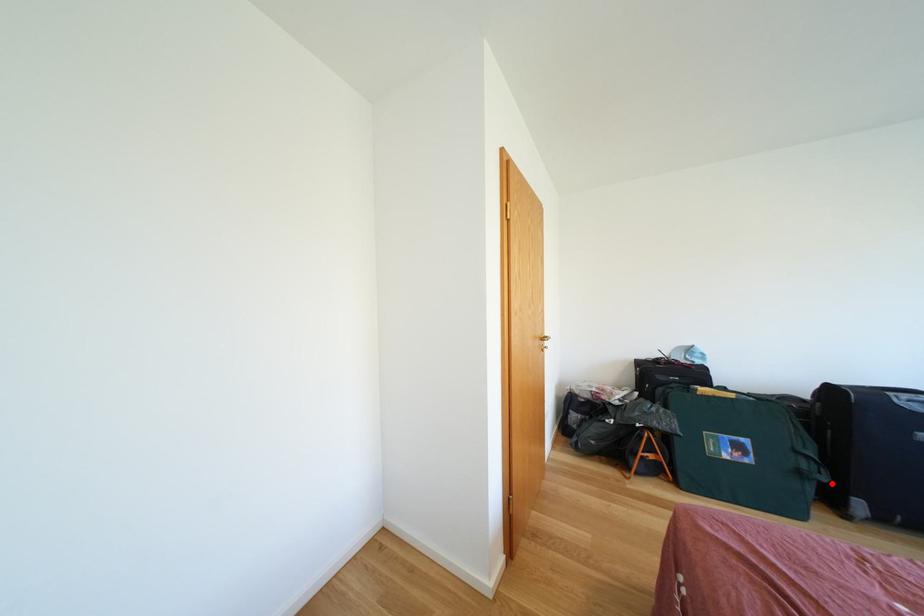
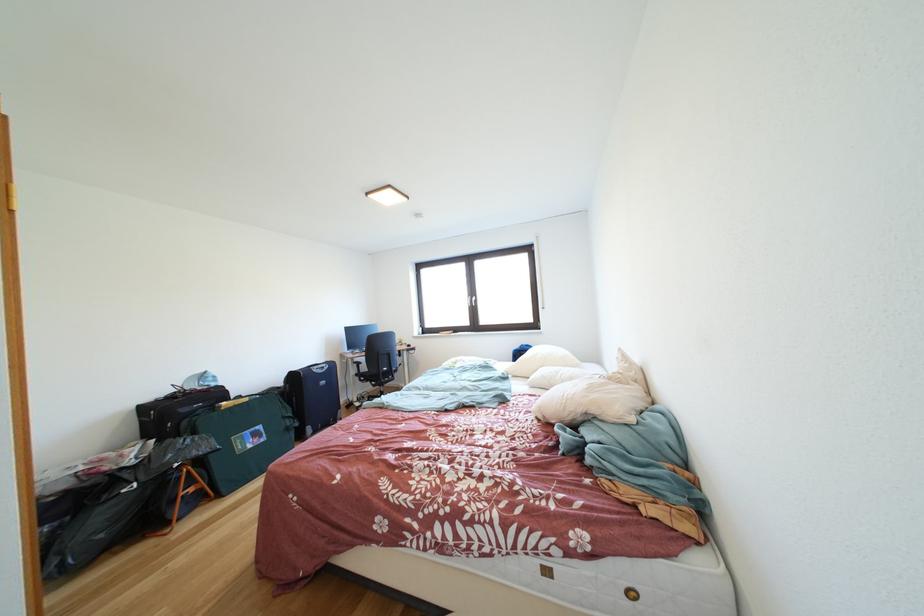
In the second image, find the point that corresponds to the highlighted location in the first image.

(306, 429)